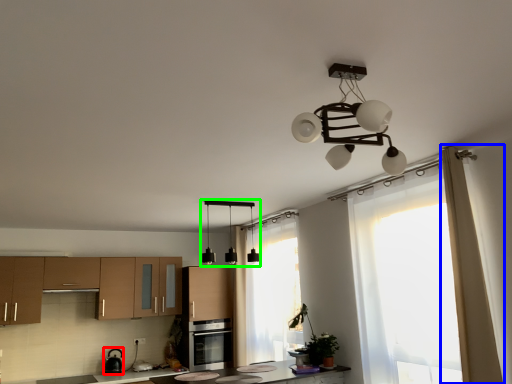
Question: Which is farther away from appliance (highlighted by a red box)? curtain (highlighted by a blue box) or lamp (highlighted by a green box)?

Choices:
 (A) curtain
 (B) lamp

Answer: (A)